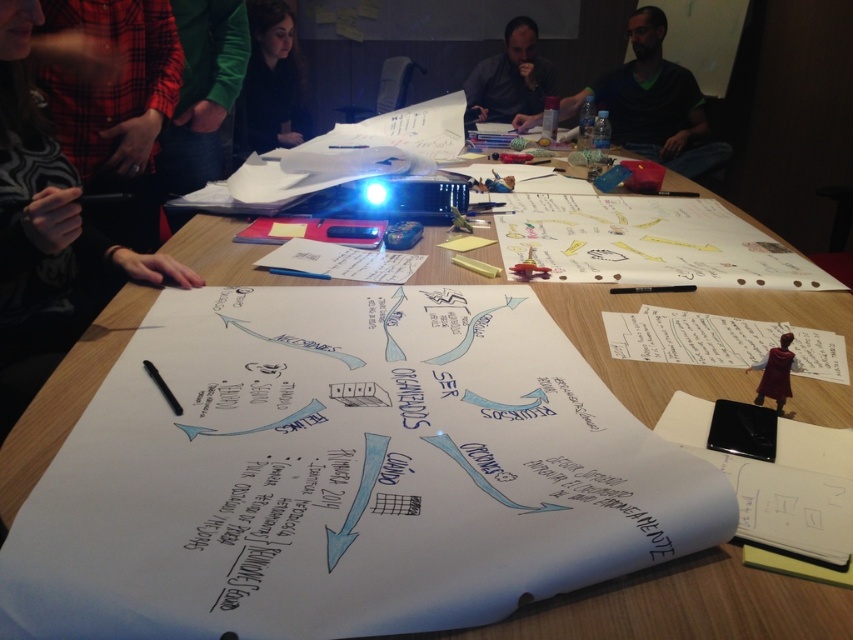
Looking at this image, can you confirm if dark gray shirt at center is positioned to the left of red velvet cape at lower right?

Incorrect, dark gray shirt at center is not on the left side of red velvet cape at lower right.

Can you confirm if dark gray shirt at center is positioned above red velvet cape at lower right?

Yes, dark gray shirt at center is above red velvet cape at lower right.

This screenshot has height=640, width=853. I want to click on dark gray shirt at center, so click(509, 77).

Where is `dark gray shirt at center`? The width and height of the screenshot is (853, 640). dark gray shirt at center is located at coordinates (509, 77).

Which is more to the left, red velvet cape at lower right or black plastic pen at center?

Positioned to the left is black plastic pen at center.

Is red velvet cape at lower right below black plastic pen at center?

Correct, red velvet cape at lower right is located below black plastic pen at center.

Does point (758, 394) lie behind point (683, 289)?

No, it is not.

I want to click on red velvet cape at lower right, so click(x=775, y=372).

Can you confirm if matte black hair at upper center is positioned to the right of red velvet cape at lower right?

No, matte black hair at upper center is not to the right of red velvet cape at lower right.

Is matte black hair at upper center closer to camera compared to red velvet cape at lower right?

No, it is behind red velvet cape at lower right.

Image resolution: width=853 pixels, height=640 pixels. Find the location of `matte black hair at upper center`. matte black hair at upper center is located at coordinates (270, 83).

Find the location of a particular element. This screenshot has width=853, height=640. matte black hair at upper center is located at coordinates (270, 83).